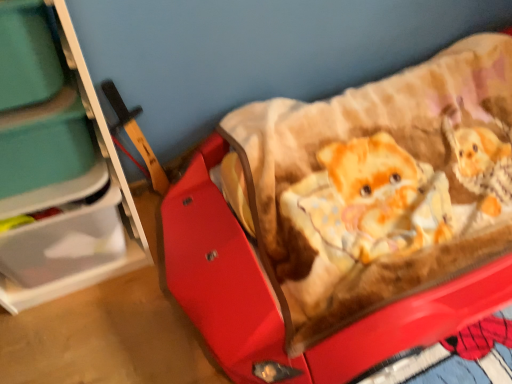
Question: Considering the relative sizes of translucent plastic storage at left and teal plastic storage box at left in the image provided, is translucent plastic storage at left shorter than teal plastic storage box at left?

Choices:
 (A) yes
 (B) no

Answer: (B)

Question: Does translucent plastic storage at left have a greater width compared to teal plastic storage box at left?

Choices:
 (A) yes
 (B) no

Answer: (A)

Question: Is translucent plastic storage at left in contact with teal plastic storage box at left?

Choices:
 (A) no
 (B) yes

Answer: (A)

Question: Could you tell me if translucent plastic storage at left is turned towards teal plastic storage box at left?

Choices:
 (A) no
 (B) yes

Answer: (B)

Question: Considering the relative sizes of translucent plastic storage at left and teal plastic storage box at left in the image provided, is translucent plastic storage at left thinner than teal plastic storage box at left?

Choices:
 (A) no
 (B) yes

Answer: (A)

Question: Does translucent plastic storage at left come in front of teal plastic storage box at left?

Choices:
 (A) yes
 (B) no

Answer: (A)

Question: Does red plastic baby carriage at center appear on the right side of translucent plastic storage at left?

Choices:
 (A) yes
 (B) no

Answer: (A)

Question: Is red plastic baby carriage at center turned away from translucent plastic storage at left?

Choices:
 (A) no
 (B) yes

Answer: (A)

Question: From a real-world perspective, is red plastic baby carriage at center on top of translucent plastic storage at left?

Choices:
 (A) no
 (B) yes

Answer: (A)

Question: Is translucent plastic storage at left inside red plastic baby carriage at center?

Choices:
 (A) no
 (B) yes

Answer: (A)

Question: Is red plastic baby carriage at center taller than translucent plastic storage at left?

Choices:
 (A) yes
 (B) no

Answer: (B)

Question: Does red plastic baby carriage at center have a larger size compared to translucent plastic storage at left?

Choices:
 (A) yes
 (B) no

Answer: (A)

Question: Is red plastic baby carriage at center in contact with teal plastic storage box at left?

Choices:
 (A) no
 (B) yes

Answer: (A)